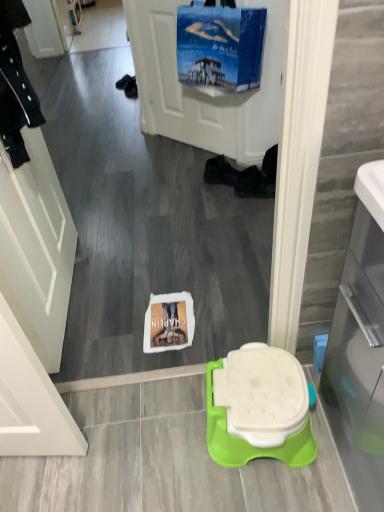
Image resolution: width=384 pixels, height=512 pixels. Find the location of `transparent glass door at right`. transparent glass door at right is located at coordinates (359, 362).

In order to face white plastic toilet at center, should I rotate leftwards or rightwards?

Turn right by 7.120 degrees to look at white plastic toilet at center.

The height and width of the screenshot is (512, 384). What do you see at coordinates (255, 183) in the screenshot?
I see `black fabric shoe at center, which is counted as the second footwear, starting from the left` at bounding box center [255, 183].

Find the location of a particular element. The height and width of the screenshot is (512, 384). blue fabric screen door at upper center, arranged as the first screen door when viewed from the back is located at coordinates (207, 94).

This screenshot has height=512, width=384. In order to click on white matte screen door at left, arranged as the first screen door when viewed from the front in this screenshot , I will do `click(36, 248)`.

You are a GUI agent. You are given a task and a screenshot of the screen. Output one action in this format:
    pyautogui.click(x=<x>, y=<y>)
    Task: Click on the transparent glass door at right
    The height and width of the screenshot is (512, 384).
    Given the screenshot: What is the action you would take?
    pyautogui.click(x=359, y=362)

Which of these two, white plastic toilet at center or transparent glass door at right, stands taller?

transparent glass door at right is taller.

From a real-world perspective, between white plastic toilet at center and transparent glass door at right, who is vertically lower?

white plastic toilet at center is physically lower.

Does white plastic toilet at center touch transparent glass door at right?

There is a gap between white plastic toilet at center and transparent glass door at right.

From the image's perspective, who appears lower, white plastic toilet at center or transparent glass door at right?

From the image's view, white plastic toilet at center is below.

Can you confirm if transparent glass door at right is positioned to the right of white plastic toilet at center?

Indeed, transparent glass door at right is positioned on the right side of white plastic toilet at center.

Considering the relative sizes of transparent glass door at right and white plastic toilet at center in the image provided, is transparent glass door at right bigger than white plastic toilet at center?

Yes, transparent glass door at right is bigger than white plastic toilet at center.

Is transparent glass door at right in contact with white plastic toilet at center?

No, transparent glass door at right is not in contact with white plastic toilet at center.

Can you confirm if black fabric shoe at center, which is the second footwear from right to left, is thinner than white matte screen door at left, the 2th screen door when ordered from back to front?

No, black fabric shoe at center, which is the second footwear from right to left, is not thinner than white matte screen door at left, the 2th screen door when ordered from back to front.

From a real-world perspective, relative to white matte screen door at left, which appears as the 2th screen door when viewed from the right, is black fabric shoe at center, the first footwear viewed from the left, vertically above or below?

In terms of real-world spatial position, black fabric shoe at center, the first footwear viewed from the left, is below white matte screen door at left, which appears as the 2th screen door when viewed from the right.

At what (x,y) coordinates should I click in order to perform the action: click on screen door that is the 2nd object located in front of the black fabric shoe at center, the first footwear viewed from the left. Please return your answer as a coordinate pair (x, y). The width and height of the screenshot is (384, 512). Looking at the image, I should click on (36, 248).

Considering the sizes of objects transparent glass door at right and black fabric shoe at center, the first footwear viewed from the left, in the image provided, who is bigger, transparent glass door at right or black fabric shoe at center, the first footwear viewed from the left,?

transparent glass door at right is bigger.

Would you say black fabric shoe at center, which is the second footwear from right to left, is part of transparent glass door at right's contents?

That's incorrect, black fabric shoe at center, which is the second footwear from right to left, is not inside transparent glass door at right.

From the image's perspective, is transparent glass door at right positioned above or below black fabric shoe at center, the first footwear viewed from the left?

transparent glass door at right is situated lower than black fabric shoe at center, the first footwear viewed from the left, in the image.

Which is behind, point (257, 431) or point (53, 344)?

The point (53, 344) is farther.

Which object is more forward, white plastic toilet at center or white matte screen door at left, arranged as the first screen door when viewed from the front?

white matte screen door at left, arranged as the first screen door when viewed from the front, is closer to the camera.

From a real-world perspective, is white plastic toilet at center positioned under white matte screen door at left, which ranks as the first screen door in left-to-right order, based on gravity?

Yes, from a real-world perspective, white plastic toilet at center is under white matte screen door at left, which ranks as the first screen door in left-to-right order.

Is white plastic toilet at center located outside white matte screen door at left, arranged as the first screen door when viewed from the front?

white plastic toilet at center is positioned outside white matte screen door at left, arranged as the first screen door when viewed from the front.

In the scene shown: Between transparent glass door at right and black fabric shoe at center, which is counted as the second footwear, starting from the left, which one has less height?

With less height is black fabric shoe at center, which is counted as the second footwear, starting from the left.

Considering the sizes of objects transparent glass door at right and black fabric shoe at center, acting as the first footwear starting from the right, in the image provided, who is smaller, transparent glass door at right or black fabric shoe at center, acting as the first footwear starting from the right,?

black fabric shoe at center, acting as the first footwear starting from the right, is smaller.

Is black fabric shoe at center, which is counted as the second footwear, starting from the left, a part of transparent glass door at right?

No, black fabric shoe at center, which is counted as the second footwear, starting from the left, is not a part of transparent glass door at right.

Is transparent glass door at right in front of or behind black fabric shoe at center, which is counted as the second footwear, starting from the left, in the image?

Clearly, transparent glass door at right is in front of black fabric shoe at center, which is counted as the second footwear, starting from the left.

How far apart are blue fabric screen door at upper center, the second screen door in the bottom-to-top sequence, and black fabric shoe at center, acting as the first footwear starting from the right?

22.08 inches.

Looking at the image, does blue fabric screen door at upper center, the first screen door when ordered from right to left, seem bigger or smaller compared to black fabric shoe at center, acting as the first footwear starting from the right?

blue fabric screen door at upper center, the first screen door when ordered from right to left, is bigger than black fabric shoe at center, acting as the first footwear starting from the right.

Can you confirm if blue fabric screen door at upper center, which is the second screen door in front-to-back order, is taller than black fabric shoe at center, acting as the first footwear starting from the right?

Correct, blue fabric screen door at upper center, which is the second screen door in front-to-back order, is much taller as black fabric shoe at center, acting as the first footwear starting from the right.

Looking at this image, from the image's perspective, which is above, blue fabric screen door at upper center, arranged as the first screen door when viewed from the back, or black fabric shoe at center, which is counted as the second footwear, starting from the left?

blue fabric screen door at upper center, arranged as the first screen door when viewed from the back.

Where is `toilet on the left of transparent glass door at right`? Image resolution: width=384 pixels, height=512 pixels. toilet on the left of transparent glass door at right is located at coordinates (258, 408).

Find the location of a particular element. toilet located behind the transparent glass door at right is located at coordinates (258, 408).

Estimate the real-world distances between objects in this image. Which object is further from white plastic toilet at center, transparent glass door at right or white matte screen door at left, arranged as the 1th screen door when ordered from the bottom?

white matte screen door at left, arranged as the 1th screen door when ordered from the bottom.

Considering their positions, is transparent glass door at right positioned closer to white plastic toilet at center than blue fabric screen door at upper center, which is the second screen door in left-to-right order?

transparent glass door at right is positioned closer to the anchor white plastic toilet at center.

Considering their positions, is white plastic toilet at center positioned closer to black fabric shoe at center, which is counted as the second footwear, starting from the left, than transparent glass door at right?

white plastic toilet at center is positioned closer to the anchor black fabric shoe at center, which is counted as the second footwear, starting from the left.

Estimate the real-world distances between objects in this image. Which object is closer to black fabric shoe at center, which is counted as the second footwear, starting from the left, blue fabric screen door at upper center, the first screen door from the top, or transparent glass door at right?

blue fabric screen door at upper center, the first screen door from the top, is positioned closer to the anchor black fabric shoe at center, which is counted as the second footwear, starting from the left.

Looking at the image, which one is located further to white plastic toilet at center, black fabric shoe at center, acting as the first footwear starting from the right, or white matte screen door at left, arranged as the first screen door when viewed from the front?

black fabric shoe at center, acting as the first footwear starting from the right.

Which object lies nearer to the anchor point black fabric shoe at center, acting as the first footwear starting from the right, white matte screen door at left, arranged as the first screen door when viewed from the front, or transparent glass door at right?

white matte screen door at left, arranged as the first screen door when viewed from the front.

Based on their spatial positions, is transparent glass door at right or black fabric shoe at center, which is counted as the second footwear, starting from the left, further from black fabric shoe at center, which is the second footwear from right to left?

Among the two, transparent glass door at right is located further to black fabric shoe at center, which is the second footwear from right to left.

In the scene shown: When comparing their distances from white matte screen door at left, the 2th screen door when ordered from back to front, does transparent glass door at right or black fabric shoe at center, the first footwear viewed from the left, seem further?

black fabric shoe at center, the first footwear viewed from the left.

This screenshot has width=384, height=512. I want to click on footwear between white matte screen door at left, arranged as the 1th screen door when ordered from the bottom, and black fabric shoe at center, which is the second footwear from right to left, in the front-back direction, so click(255, 183).

The height and width of the screenshot is (512, 384). I want to click on toilet between transparent glass door at right and black fabric shoe at center, which is the second footwear from right to left, from front to back, so click(258, 408).

Find the location of a particular element. The height and width of the screenshot is (512, 384). screen door between white matte screen door at left, which is counted as the second screen door, starting from the top, and black fabric shoe at center, acting as the first footwear starting from the right, from front to back is located at coordinates (x=207, y=94).

At what (x,y) coordinates should I click in order to perform the action: click on toilet between transparent glass door at right and black fabric shoe at center, acting as the first footwear starting from the right, along the z-axis. Please return your answer as a coordinate pair (x, y). Looking at the image, I should click on (258, 408).